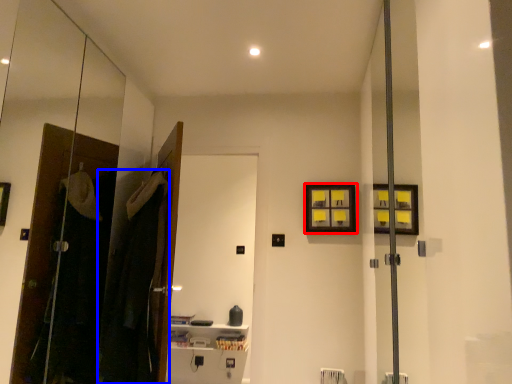
Question: Which object appears farthest to the camera in this image, picture frame (highlighted by a red box) or laundry (highlighted by a blue box)?

Choices:
 (A) picture frame
 (B) laundry

Answer: (A)